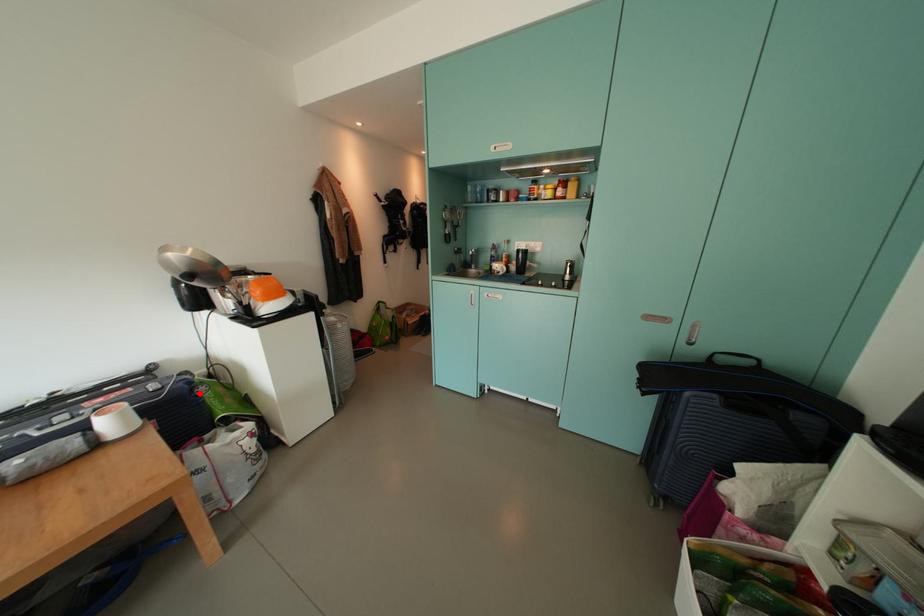
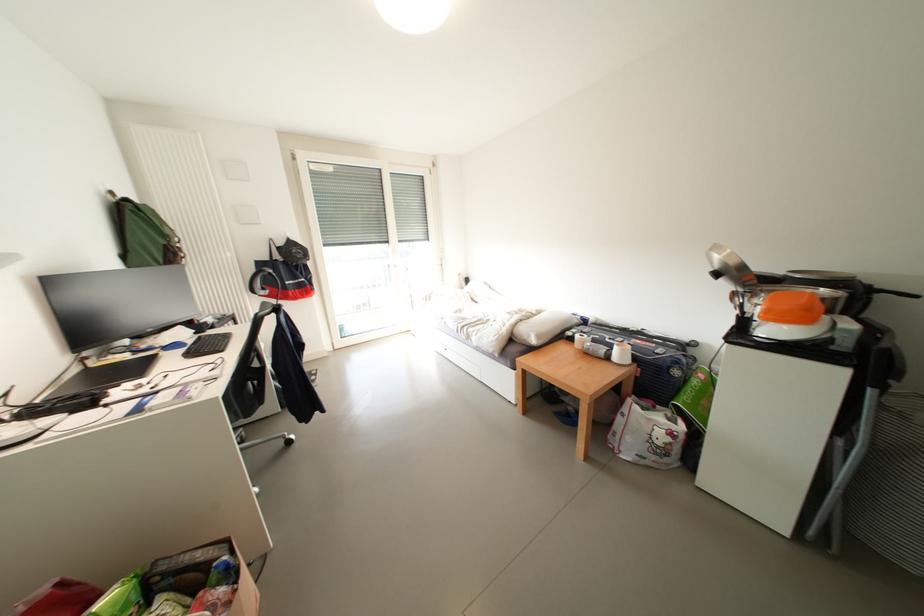
Question: I am providing you with two images of the same scene from different viewpoints. Given a red point in image1, look at the same physical point in image2. Is it:

Choices:
 (A) Closer to the viewpoint
 (B) Farther from the viewpoint

Answer: (B)